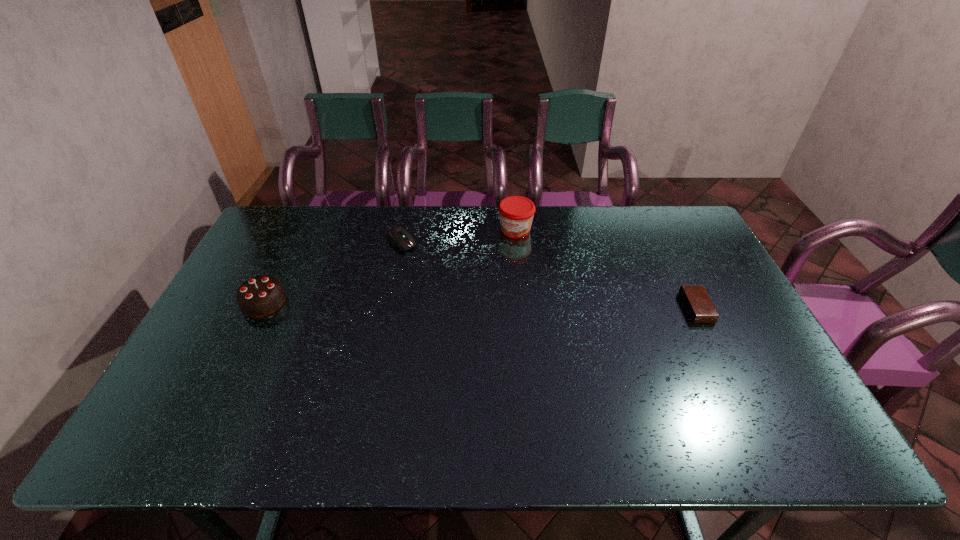
The height and width of the screenshot is (540, 960). Find the location of `blank area in the image that satisfies the following two spatial constraints: 1. on the back side of the leftmost object; 2. on the right side of the second shortest object`. blank area in the image that satisfies the following two spatial constraints: 1. on the back side of the leftmost object; 2. on the right side of the second shortest object is located at coordinates (294, 241).